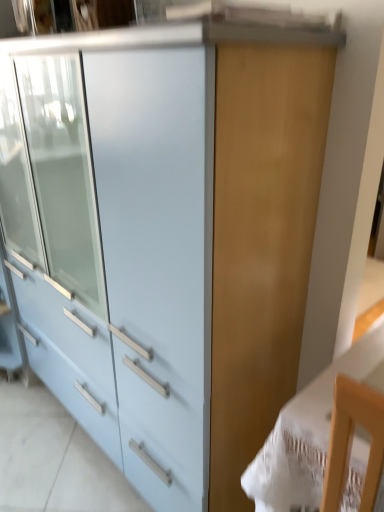
Find the location of a particular element. This screenshot has width=384, height=512. wooden chair at right is located at coordinates (308, 433).

Image resolution: width=384 pixels, height=512 pixels. Describe the element at coordinates (308, 433) in the screenshot. I see `wooden chair at right` at that location.

What is the approximate height of wooden chair at right?

85.47 centimeters.

Identify the location of wooden chair at right. This screenshot has width=384, height=512. (308, 433).